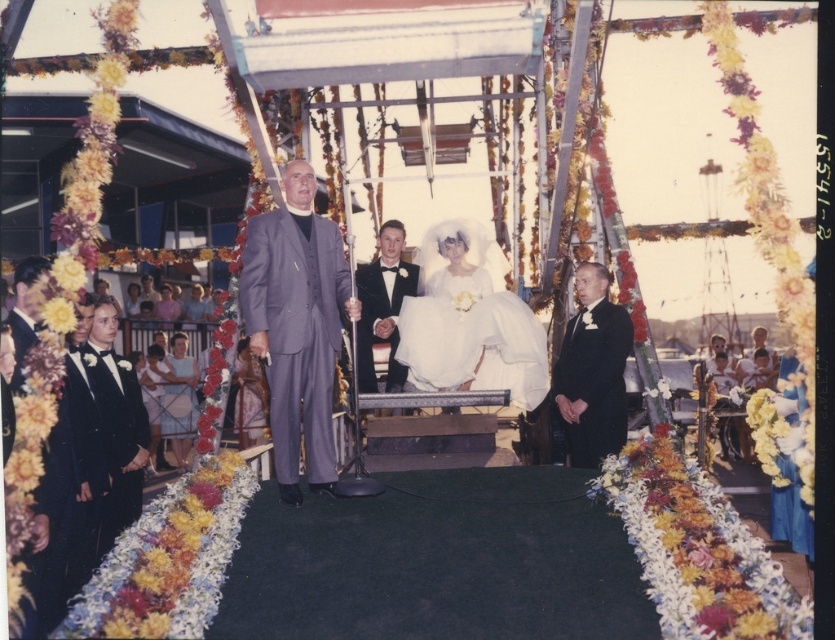
Question: Which is nearer to the black satin tuxedo at center?

Choices:
 (A) black satin tuxedo at left
 (B) black satin suit at right
 (C) matte gray suit at center
 (D) white satin dress at center

Answer: (D)

Question: Is black satin tuxedo at left below black satin tuxedo at center?

Choices:
 (A) no
 (B) yes

Answer: (B)

Question: Which point is farther to the camera?

Choices:
 (A) (383, 257)
 (B) (505, 308)

Answer: (A)

Question: Can you confirm if matte gray suit at center is positioned to the right of white satin dress at center?

Choices:
 (A) no
 (B) yes

Answer: (A)

Question: Considering the relative positions of black satin suit at right and black satin tuxedo at center in the image provided, where is black satin suit at right located with respect to black satin tuxedo at center?

Choices:
 (A) above
 (B) below

Answer: (B)

Question: Which object is closer to the camera taking this photo?

Choices:
 (A) matte gray suit at center
 (B) black satin suit at right
 (C) white satin dress at center

Answer: (A)